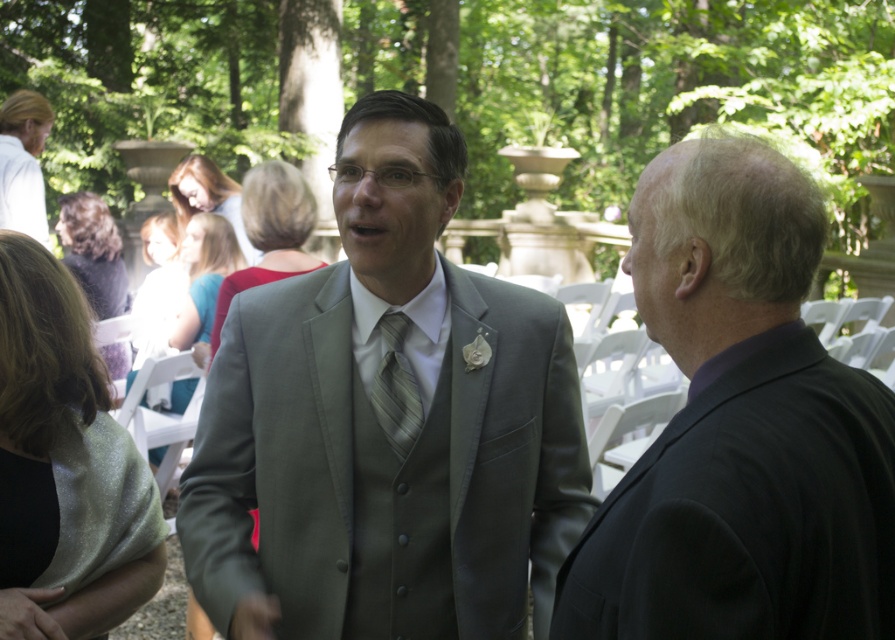
Is matte gray suit at center below striped silk tie at center?

Incorrect, matte gray suit at center is not positioned below striped silk tie at center.

Who is shorter, matte gray suit at center or striped silk tie at center?

With less height is striped silk tie at center.

Which is behind, point (303, 586) or point (403, 326)?

The point (403, 326) is behind.

Find the location of `matte gray suit at center`. matte gray suit at center is located at coordinates (x=380, y=428).

This screenshot has height=640, width=895. What do you see at coordinates (380, 428) in the screenshot?
I see `matte gray suit at center` at bounding box center [380, 428].

Locate an element on the screen. Image resolution: width=895 pixels, height=640 pixels. matte gray suit at center is located at coordinates (380, 428).

At what (x,y) coordinates should I click in order to perform the action: click on matte gray suit at center. Please return your answer as a coordinate pair (x, y). The height and width of the screenshot is (640, 895). Looking at the image, I should click on (380, 428).

Who is lower down, dark purple suit at right or striped silk tie at center?

dark purple suit at right is below.

What do you see at coordinates (740, 428) in the screenshot?
I see `dark purple suit at right` at bounding box center [740, 428].

Is point (629, 205) behind point (394, 419)?

No, it is in front of (394, 419).

Where is `dark purple suit at right`? The image size is (895, 640). dark purple suit at right is located at coordinates (740, 428).